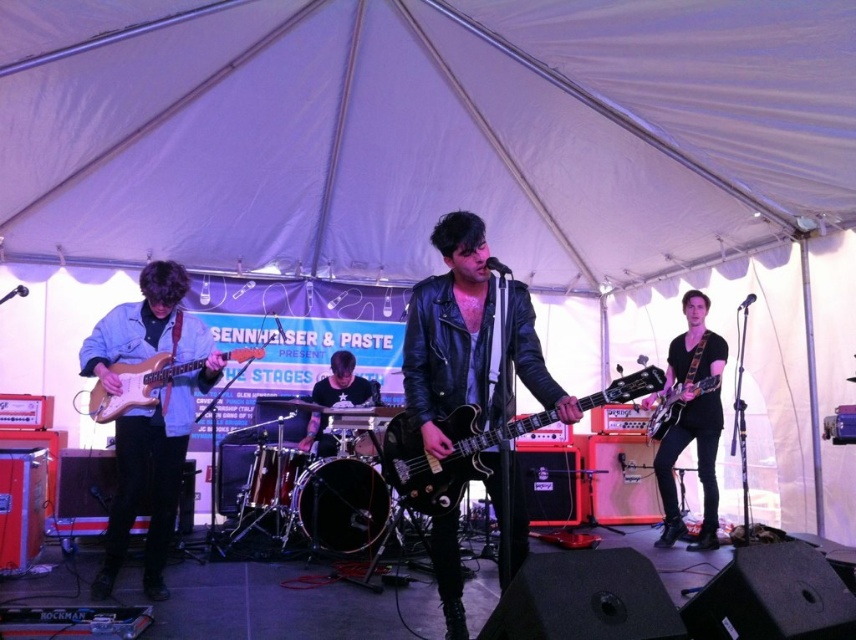
Question: Which point is closer to the camera taking this photo?

Choices:
 (A) (140, 401)
 (B) (486, 470)

Answer: (B)

Question: Which point is closer to the camera taking this photo?

Choices:
 (A) (670, 410)
 (B) (330, 397)

Answer: (A)

Question: Is denim jacket at left bigger than black leather guitar at right?

Choices:
 (A) no
 (B) yes

Answer: (B)

Question: Among these objects, which one is nearest to the camera?

Choices:
 (A) purple glossy electric guitar at right
 (B) denim jacket at left
 (C) leather jacket at center

Answer: (C)

Question: Can you confirm if light brown wood electric guitar at left is positioned above purple glossy electric guitar at right?

Choices:
 (A) yes
 (B) no

Answer: (A)

Question: Observing the image, what is the correct spatial positioning of light brown wood electric guitar at left in reference to purple glossy electric guitar at right?

Choices:
 (A) left
 (B) right

Answer: (A)